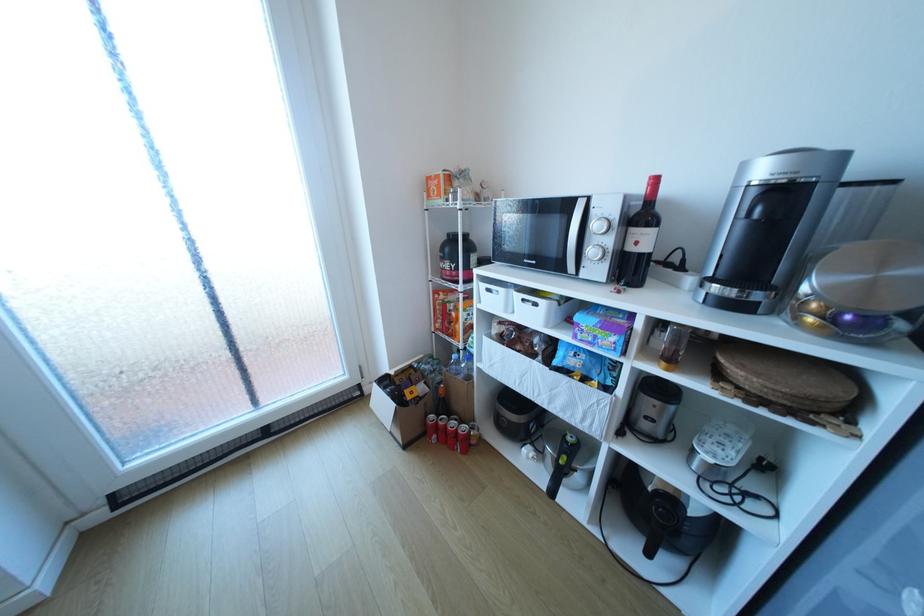
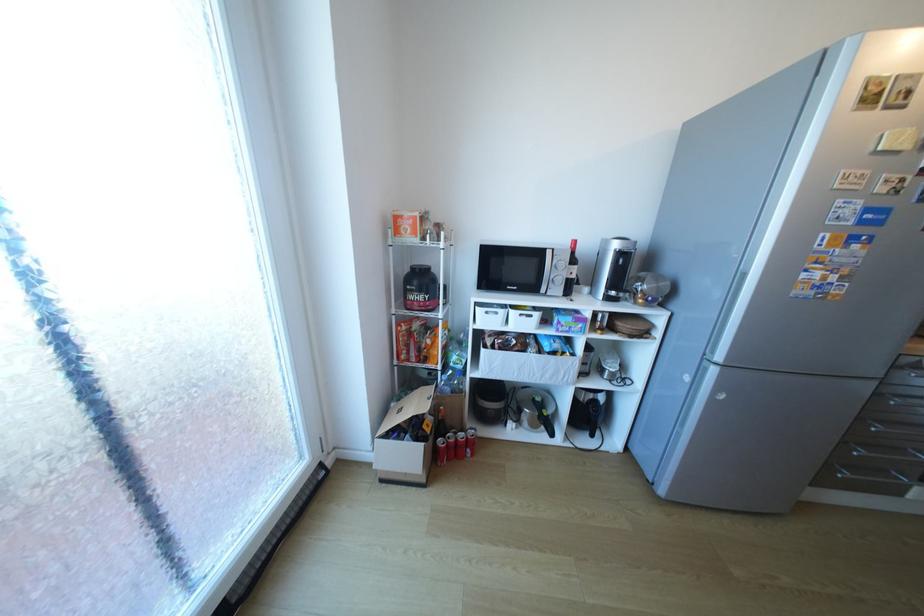
In the second image, find the point that corresponds to point (663, 507) in the first image.

(600, 408)